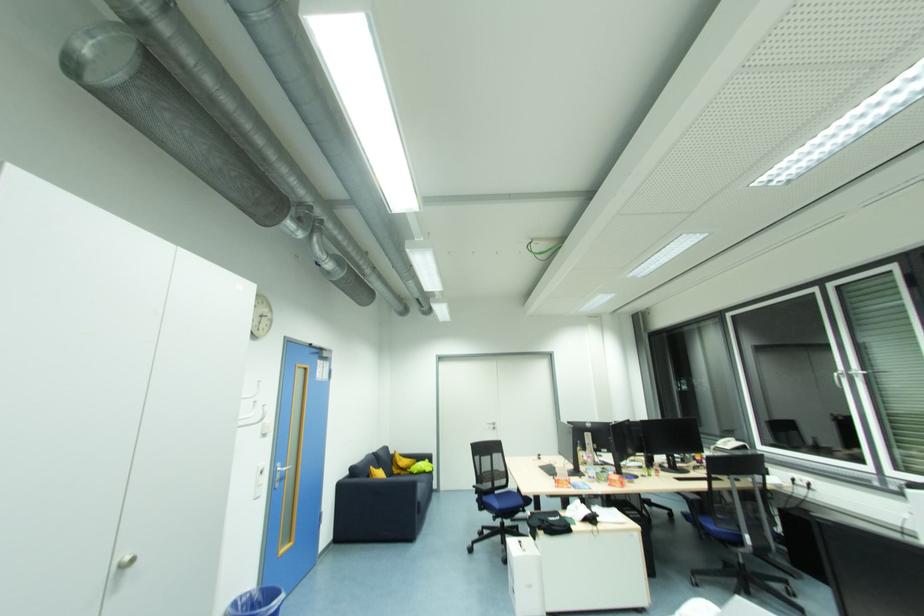
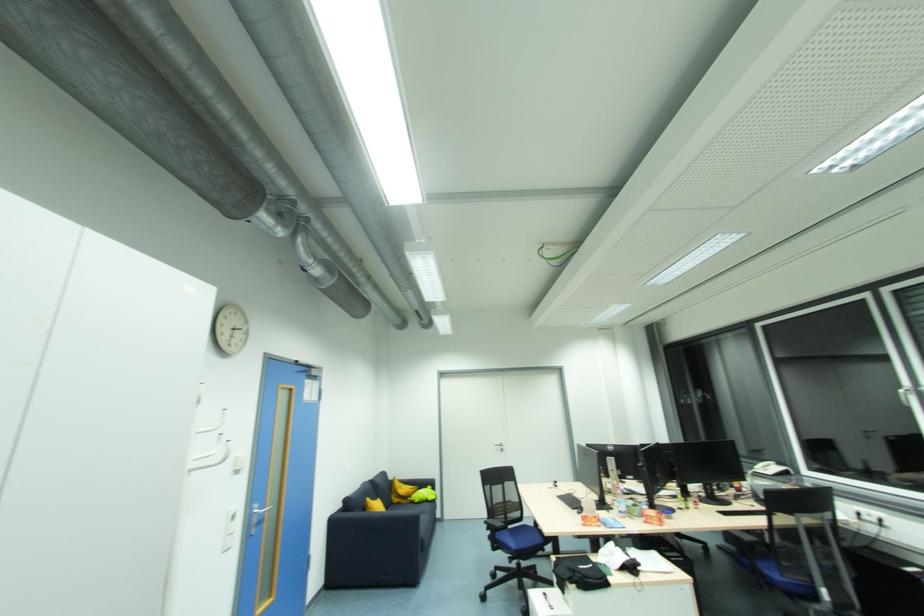
In the second image, find the point that corresponds to point 411,469 in the first image.

(412, 499)